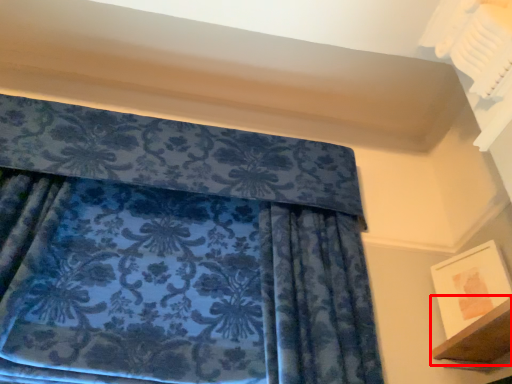
Question: From the image's perspective, where is shelf (annotated by the red box) located in relation to picture frame in the image?

Choices:
 (A) below
 (B) above

Answer: (A)